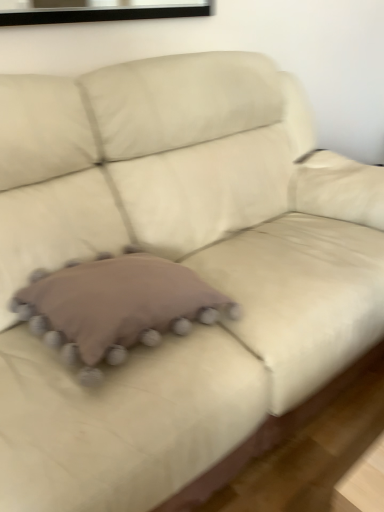
Find the location of a particular element. This screenshot has width=384, height=512. brown fabric pillow at center is located at coordinates (115, 307).

This screenshot has height=512, width=384. Describe the element at coordinates (115, 307) in the screenshot. I see `brown fabric pillow at center` at that location.

At what (x,y) coordinates should I click in order to perform the action: click on brown fabric pillow at center. Please return your answer as a coordinate pair (x, y). Looking at the image, I should click on (115, 307).